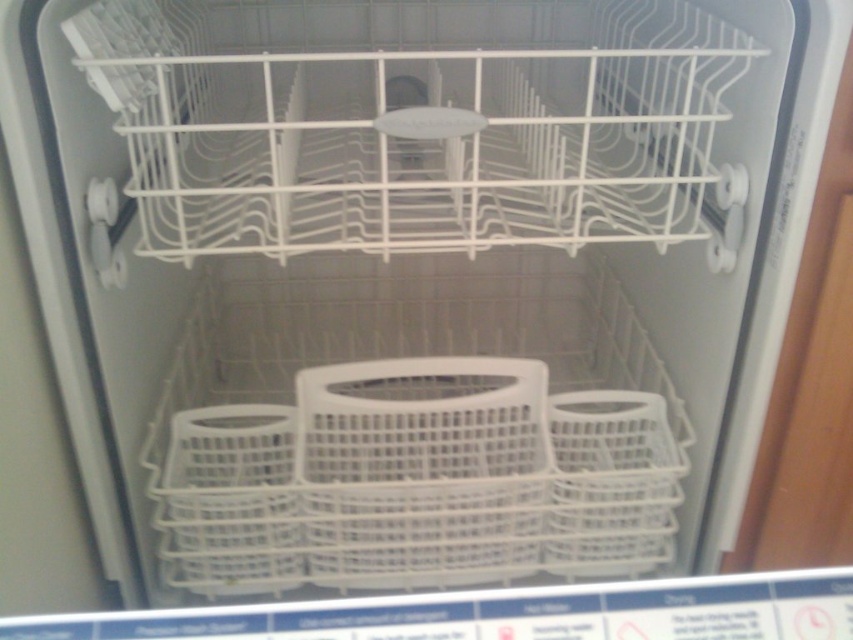
You are trying to place a small utensil in the dishwasher. You have two points marked as possible locations. Which point is closer to you, point (480, 413) or point (289, 422)?

Point (480, 413) is closer to you because it is further to the viewer than point (289, 422).

You are trying to place a 1 meter long object inside the dishwasher. The dishwasher has two points marked as point A at point (502, 570) and point B at point 0.109, 0.411. Can the object fit diagonally between these two points?

The distance between point A at (502, 570) and point B at 0.109, 0.411 is 84.25 centimeters. Since the object is 1 meter long, which is longer than the distance between the two points, it cannot fit diagonally between them.

You are trying to place a large plate that is 30 inches in diameter into the dishwasher. You see the white plastic basket at center. Can you fit the plate vertically inside the dishwasher?

The white plastic basket at center is 29.72 inches away from the camera, which means the dishwasher has limited vertical space. Since the plate is 30 inches in diameter, it is slightly larger than the available space, so it won not fit vertically inside the dishwasher.